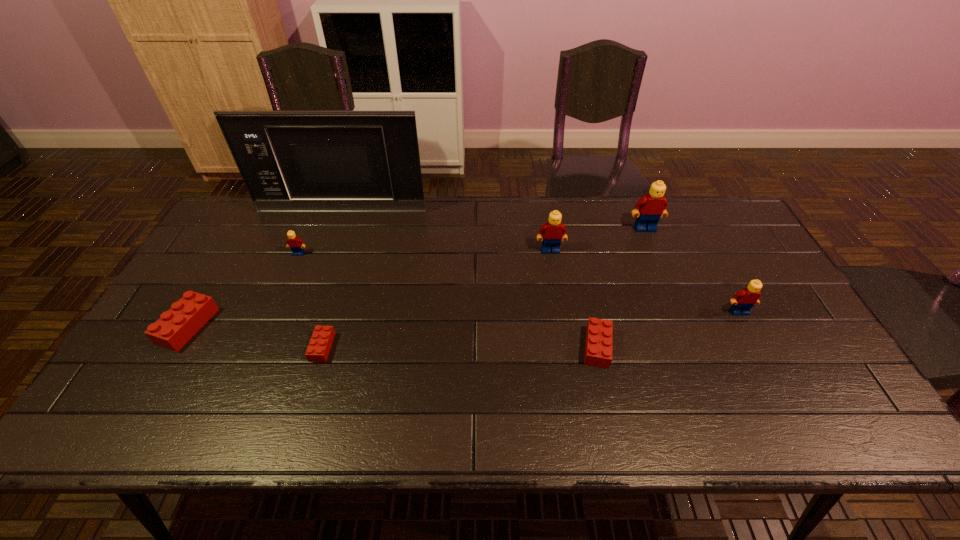
The image size is (960, 540). I want to click on the biggest red Lego, so click(x=175, y=327).

Where is `the leftmost red Lego`? the leftmost red Lego is located at coordinates (175, 327).

You are a GUI agent. You are given a task and a screenshot of the screen. Output one action in this format:
    pyautogui.click(x=<x>, y=<y>)
    Task: Click on the second biggest red Lego
    The image size is (960, 540).
    Given the screenshot: What is the action you would take?
    pyautogui.click(x=599, y=333)

Identify the location of the rightmost red Lego. (599, 333).

I want to click on the shortest Lego, so click(320, 343).

The image size is (960, 540). In order to click on the third Lego from left to right in this screenshot , I will do coord(320,343).

I want to click on vacant space situated on the front panel of the dark microwave oven, so click(x=333, y=235).

You are a GUI agent. You are given a task and a screenshot of the screen. Output one action in this format:
    pyautogui.click(x=<x>, y=<y>)
    Task: Click on the vacant area located on the front-facing side of the second object from right to left
    The width and height of the screenshot is (960, 540).
    Given the screenshot: What is the action you would take?
    pyautogui.click(x=656, y=256)

Image resolution: width=960 pixels, height=540 pixels. In order to click on free space located on the front-facing side of the third tallest object in this screenshot , I will do `click(563, 326)`.

What are the coordinates of `free space located 0.220m on the front-facing side of the rightmost Lego` in the screenshot? It's located at (780, 388).